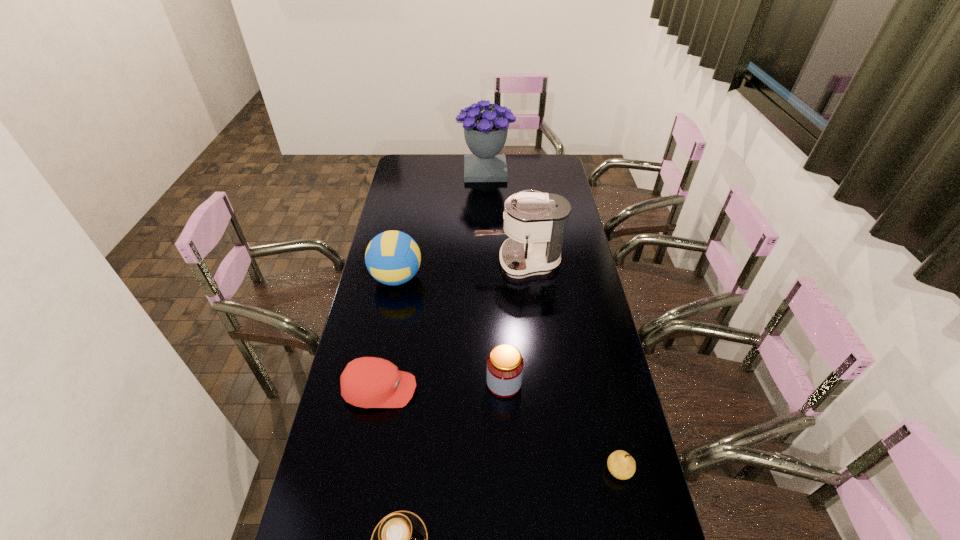
The width and height of the screenshot is (960, 540). I want to click on the tallest object, so click(485, 133).

The height and width of the screenshot is (540, 960). In order to click on bouquet in this screenshot , I will do `click(485, 133)`.

Locate an element on the screen. This screenshot has height=540, width=960. coffee maker is located at coordinates 536,223.

Identify the location of the fifth shortest object. (392, 257).

Where is `jar`? The width and height of the screenshot is (960, 540). jar is located at coordinates (505, 364).

Find the location of a particular element. cap is located at coordinates (368, 382).

Locate an element on the screen. This screenshot has height=540, width=960. the sixth farthest object is located at coordinates (621, 465).

Locate an element on the screen. The width and height of the screenshot is (960, 540). the rightmost object is located at coordinates (621, 465).

Find the location of a particular element. vacant position located on the front of the farthest object is located at coordinates (487, 231).

What are the coordinates of `vacant space located on the front-facing side of the second tallest object` in the screenshot? It's located at (463, 263).